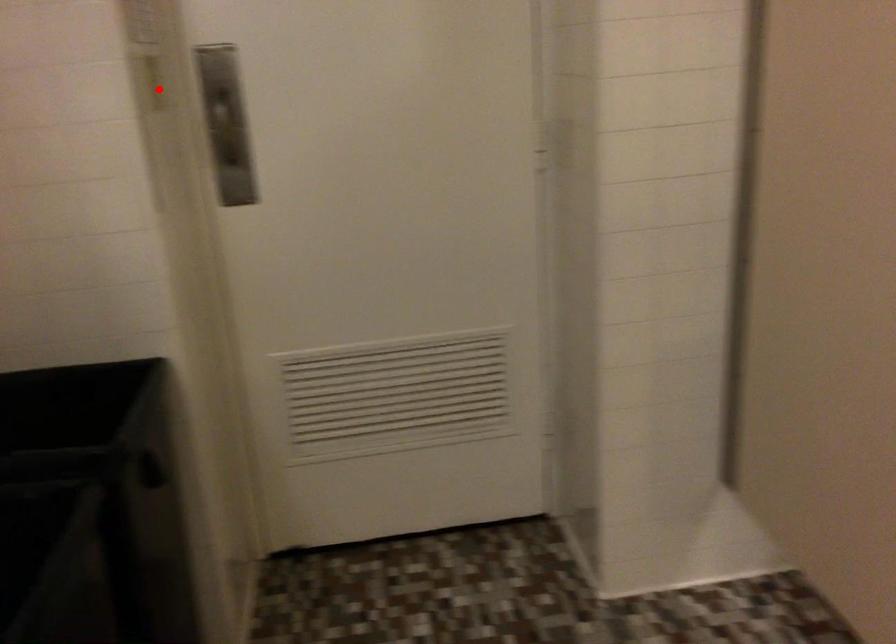
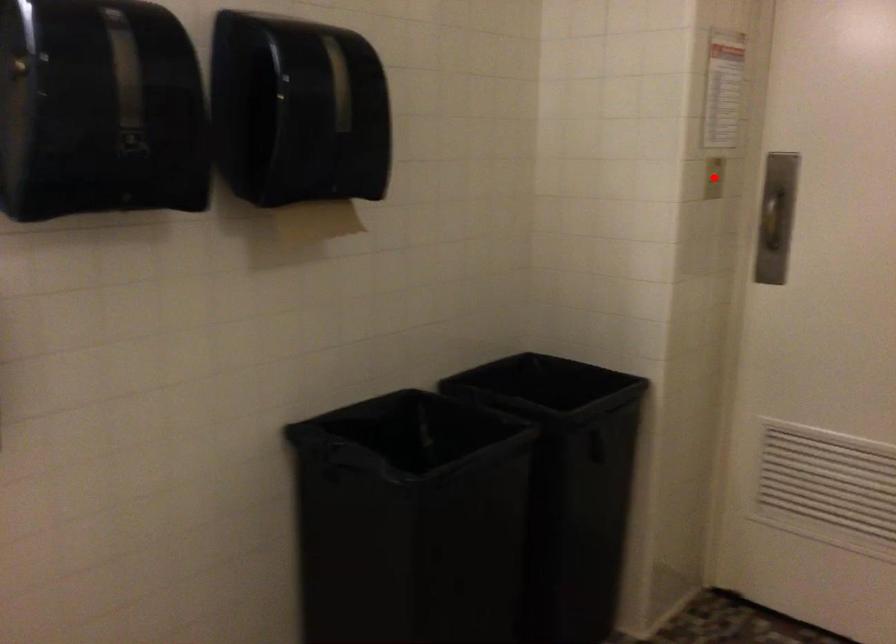
I am providing you with two images of the same scene from different viewpoints. A red point is marked on the first image and another point is marked on the second image. Does the point marked in image1 correspond to the same location as the one in image2?

Yes